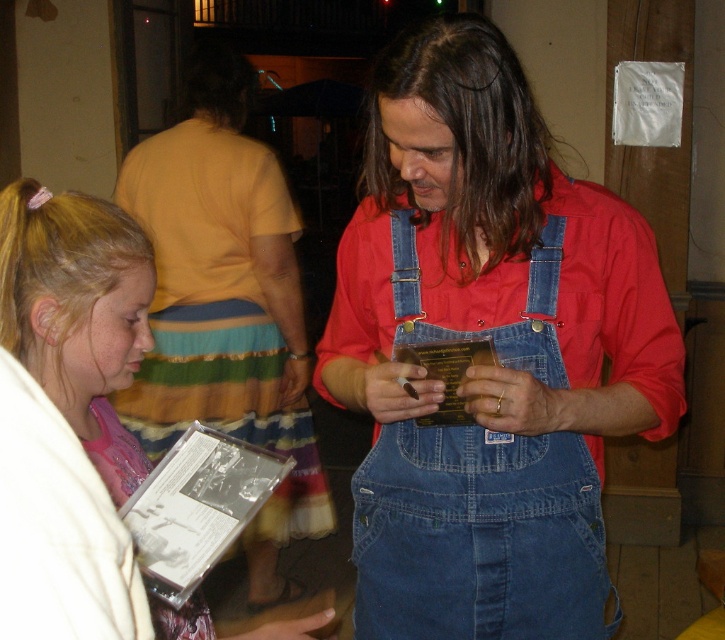
Question: Which of the following is the closest to the observer?

Choices:
 (A) white matte cd at lower left
 (B) blonde hair at lower left

Answer: (A)

Question: Is white matte cd at lower left above blonde hair at lower left?

Choices:
 (A) yes
 (B) no

Answer: (B)

Question: Among these points, which one is farthest from the camera?

Choices:
 (A) (16, 324)
 (B) (522, 595)

Answer: (B)

Question: Is denim overalls at center to the right of white matte cd at lower left from the viewer's perspective?

Choices:
 (A) no
 (B) yes

Answer: (B)

Question: Can you confirm if denim overalls at center is wider than brown/dense hair at center?

Choices:
 (A) yes
 (B) no

Answer: (A)

Question: Which point is farther from the camera taking this photo?

Choices:
 (A) (136, 230)
 (B) (377, 176)
 (C) (538, 589)

Answer: (B)